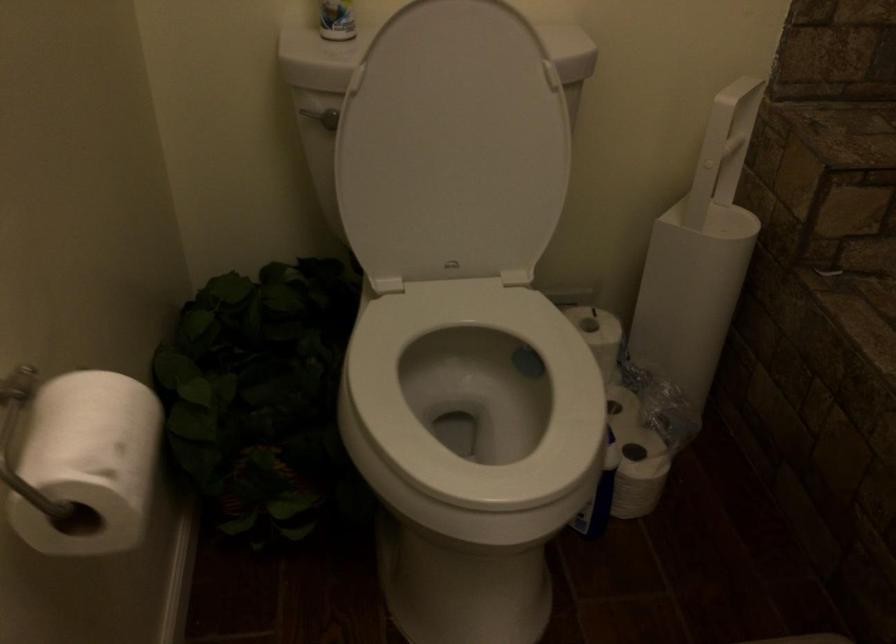
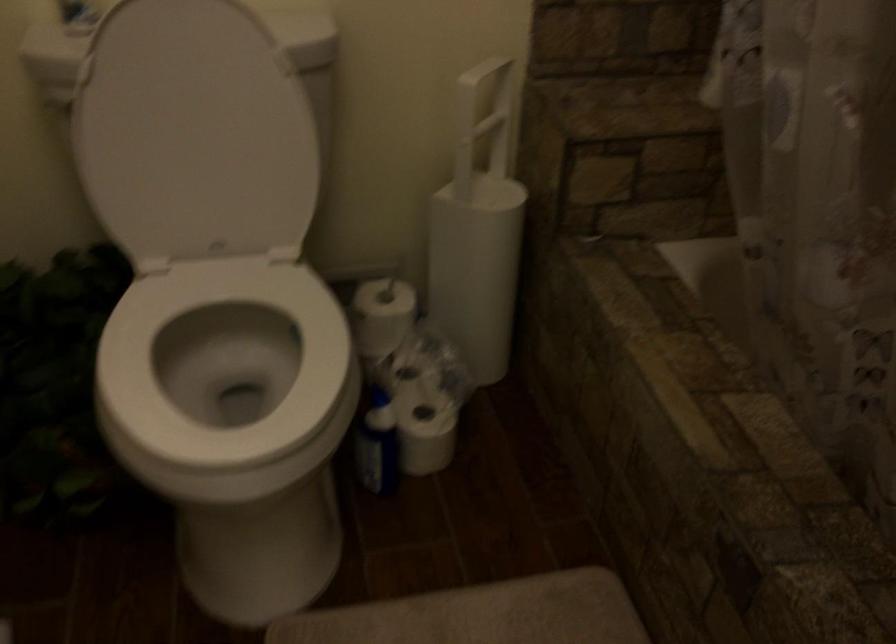
Locate, in the second image, the point that corresponds to (x=438, y=149) in the first image.

(194, 134)